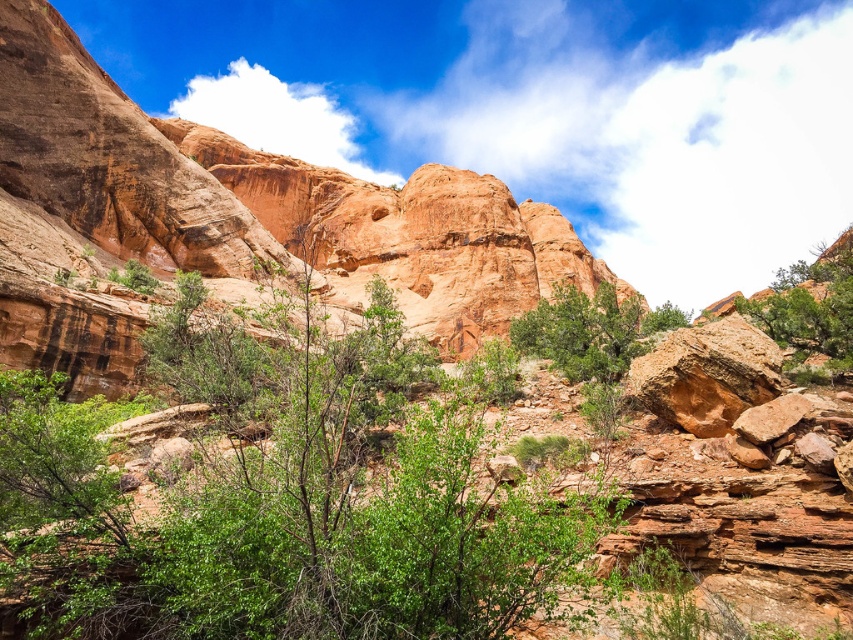
Question: Does green leafy tree at right appear over green matte tree at center?

Choices:
 (A) no
 (B) yes

Answer: (B)

Question: Which is nearer to the green matte tree at center?

Choices:
 (A) green leafy tree at right
 (B) green leafy tree at center

Answer: (A)

Question: Which point is farther from the camera taking this photo?

Choices:
 (A) (816, 323)
 (B) (354, 481)

Answer: (A)

Question: Can you confirm if green leafy tree at center is positioned above green leafy tree at right?

Choices:
 (A) no
 (B) yes

Answer: (A)

Question: Can you confirm if green leafy tree at center is wider than green leafy tree at right?

Choices:
 (A) no
 (B) yes

Answer: (A)

Question: Which point is farther from the camera taking this photo?

Choices:
 (A) (822, 324)
 (B) (550, 308)

Answer: (B)